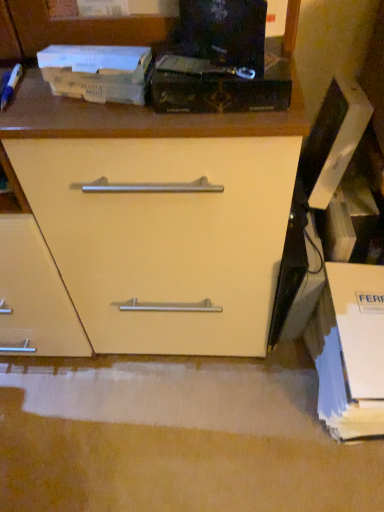
Question: Is white cardboard box at lower right oriented towards brown cardboard book at upper left, placed as the first paperback book when sorted from left to right?

Choices:
 (A) no
 (B) yes

Answer: (A)

Question: Considering the relative sizes of white cardboard box at lower right and brown cardboard book at upper left, placed as the first paperback book when sorted from left to right, in the image provided, is white cardboard box at lower right smaller than brown cardboard book at upper left, placed as the first paperback book when sorted from left to right,?

Choices:
 (A) no
 (B) yes

Answer: (A)

Question: Considering the relative positions of white cardboard box at lower right and brown cardboard book at upper left, placed as the first paperback book when sorted from left to right, in the image provided, is white cardboard box at lower right to the right of brown cardboard book at upper left, placed as the first paperback book when sorted from left to right, from the viewer's perspective?

Choices:
 (A) no
 (B) yes

Answer: (B)

Question: Considering the relative sizes of white cardboard box at lower right and brown cardboard book at upper left, arranged as the 2th paperback book when viewed from the right, in the image provided, is white cardboard box at lower right bigger than brown cardboard book at upper left, arranged as the 2th paperback book when viewed from the right,?

Choices:
 (A) yes
 (B) no

Answer: (A)

Question: From a real-world perspective, is white cardboard box at lower right beneath brown cardboard book at upper left, placed as the first paperback book when sorted from left to right?

Choices:
 (A) no
 (B) yes

Answer: (B)

Question: In the image, is white cardboard box at lower right on the left side or the right side of black matte paperback book at upper center, marked as the 2th paperback book in a left-to-right arrangement?

Choices:
 (A) left
 (B) right

Answer: (B)

Question: Based on their sizes in the image, would you say white cardboard box at lower right is bigger or smaller than black matte paperback book at upper center, which appears as the 1th paperback book when viewed from the right?

Choices:
 (A) small
 (B) big

Answer: (B)

Question: From a real-world perspective, relative to black matte paperback book at upper center, marked as the 2th paperback book in a left-to-right arrangement, is white cardboard box at lower right vertically above or below?

Choices:
 (A) below
 (B) above

Answer: (A)

Question: Considering the positions of white cardboard box at lower right and black matte paperback book at upper center, marked as the 2th paperback book in a left-to-right arrangement, in the image, is white cardboard box at lower right taller or shorter than black matte paperback book at upper center, marked as the 2th paperback book in a left-to-right arrangement,?

Choices:
 (A) short
 (B) tall

Answer: (B)

Question: Is white cardboard box at lower right in front of or behind brown cardboard book at upper left, placed as the first paperback book when sorted from left to right, in the image?

Choices:
 (A) front
 (B) behind

Answer: (B)

Question: From a real-world perspective, relative to brown cardboard book at upper left, arranged as the 2th paperback book when viewed from the right, is white cardboard box at lower right vertically above or below?

Choices:
 (A) below
 (B) above

Answer: (A)

Question: Is point coord(334,310) closer or farther from the camera than point coord(119,81)?

Choices:
 (A) closer
 (B) farther

Answer: (B)

Question: In terms of height, does white cardboard box at lower right look taller or shorter compared to brown cardboard book at upper left, placed as the first paperback book when sorted from left to right?

Choices:
 (A) short
 (B) tall

Answer: (B)

Question: In terms of height, does brown cardboard book at upper left, arranged as the 2th paperback book when viewed from the right, look taller or shorter compared to white cardboard box at lower right?

Choices:
 (A) tall
 (B) short

Answer: (B)

Question: Is point (104, 70) positioned closer to the camera than point (319, 392)?

Choices:
 (A) farther
 (B) closer

Answer: (B)